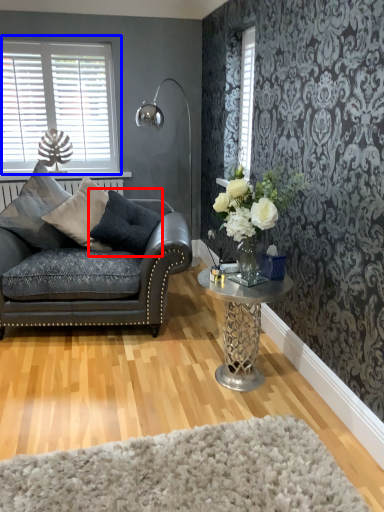
Question: Which point is closer to the camera, pillow (highlighted by a red box) or window (highlighted by a blue box)?

Choices:
 (A) pillow
 (B) window

Answer: (A)